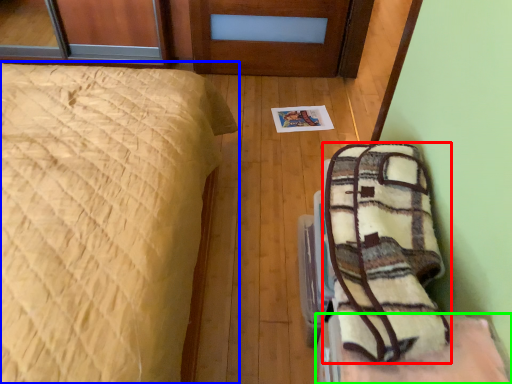
Question: Estimate the real-world distances between objects in this image. Which object is farther from blanket (highlighted by a red box), bed (highlighted by a blue box) or furniture (highlighted by a green box)?

Choices:
 (A) bed
 (B) furniture

Answer: (A)